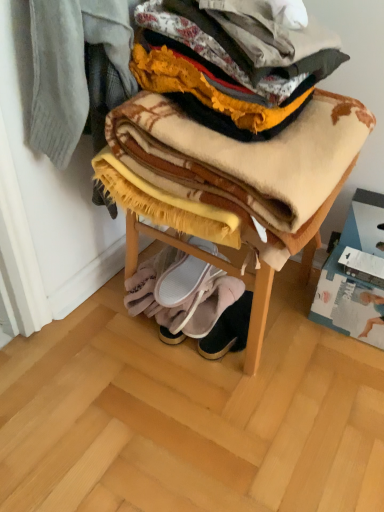
Locate an element on the screen. This screenshot has height=512, width=384. free location in front of leather suede booties at lower center, the third footwear viewed from the top is located at coordinates (241, 389).